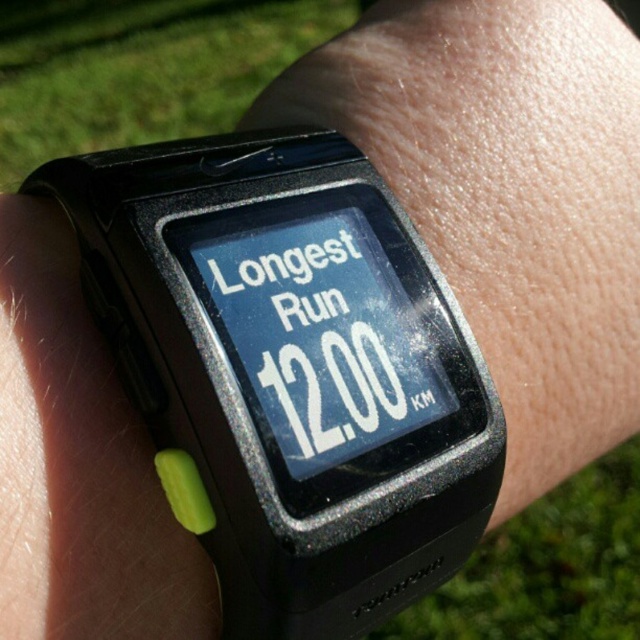
Consider the image. You are trying to decide between two smartwatches. You have the black plastic watch at center and the black rubber watch at center. Which one is narrower?

The black plastic watch at center has a lesser width compared to the black rubber watch at center, so it is narrower.

You are trying to decide which watch to wear for a hike. You have two options on your desk in front of you. The black plastic watch at center and the black rubber watch at center. Based on their sizes, which one would you choose if you want the smaller one?

The black plastic watch at center occupies less space than the black rubber watch at center, so you should choose the black plastic watch at center if you want the smaller one.